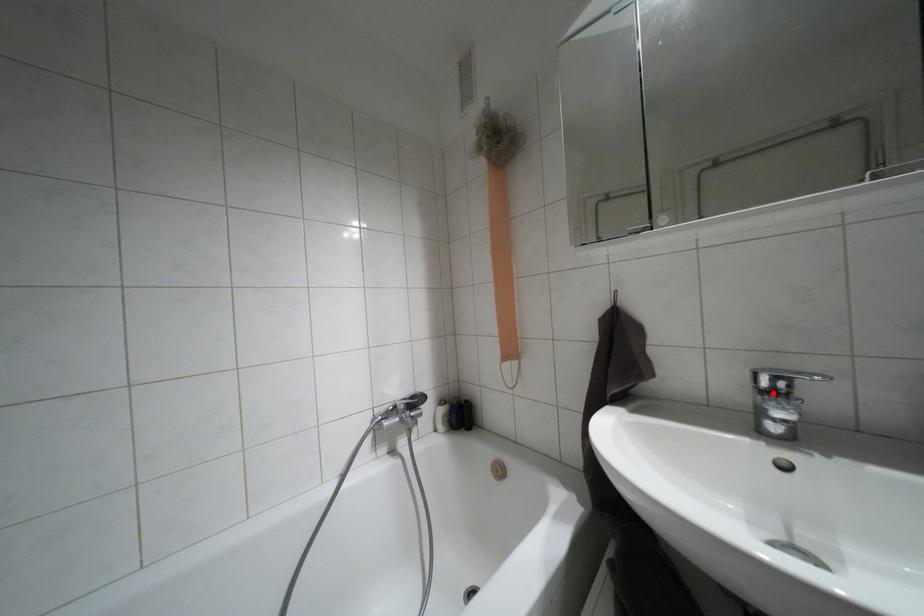
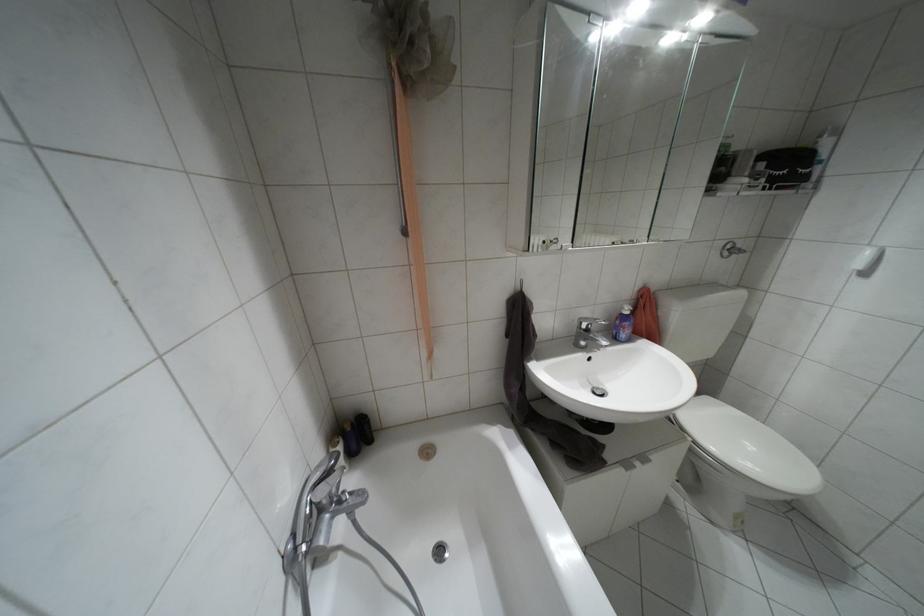
Where in the second image is the point corresponding to the highlighted location from the first image?

(587, 330)